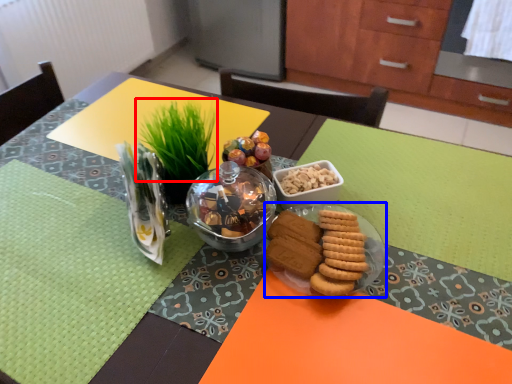
Question: Which of the following is the closest to the observer, grass (highlighted by a red box) or glass plate (highlighted by a blue box)?

Choices:
 (A) grass
 (B) glass plate

Answer: (B)